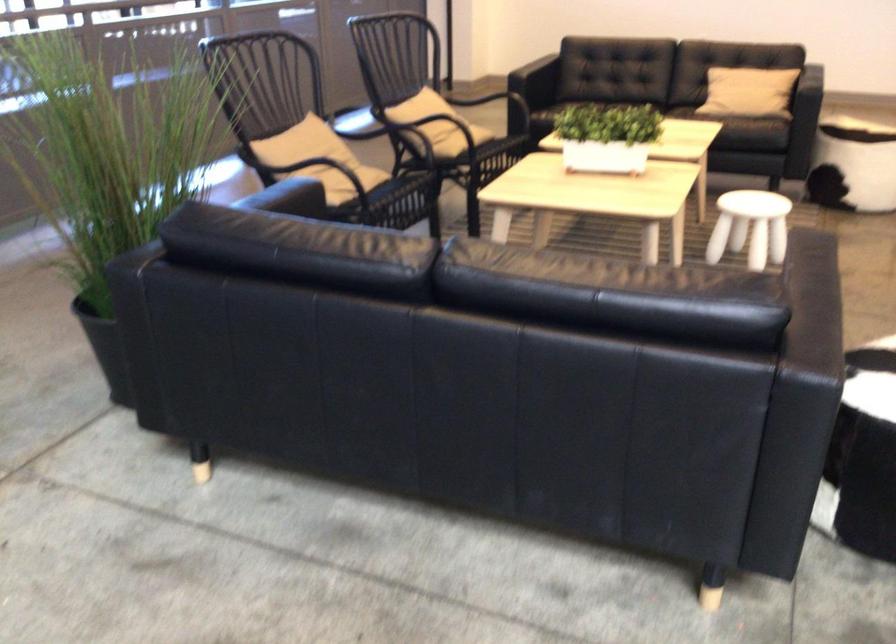
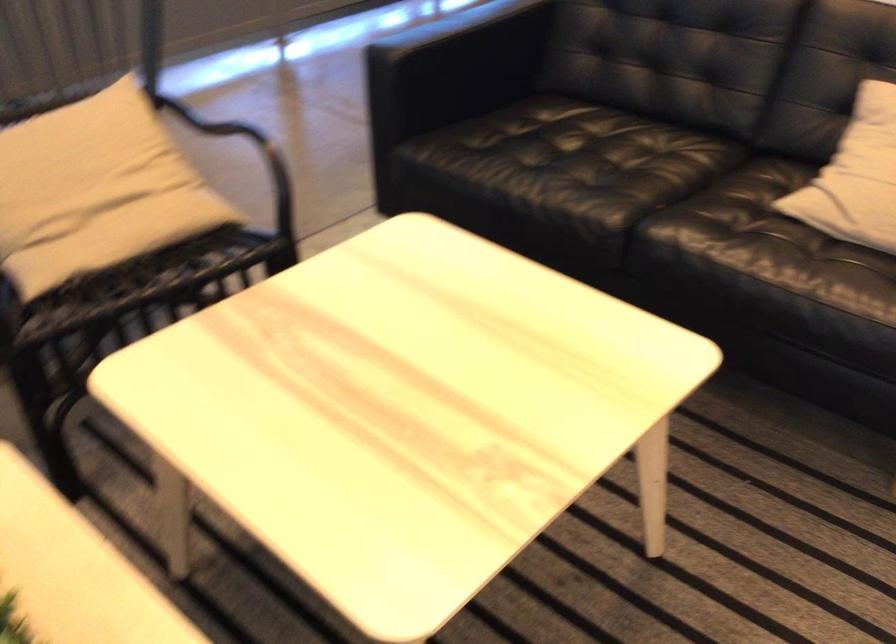
The images are taken continuously from a first-person perspective. In which direction are you moving?

The movement direction of the cameraman is right, forward.